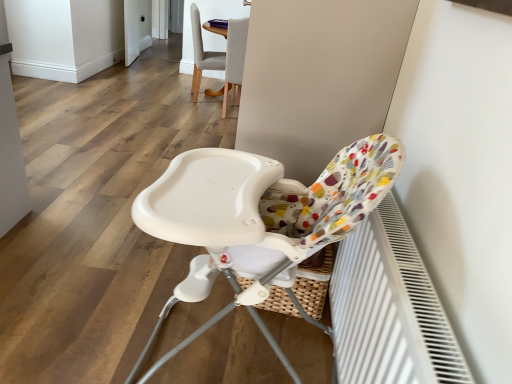
Question: Is white glossy screen door at upper left positioned with its back to white plastic highchair at center, the first chair when ordered from bottom to top?

Choices:
 (A) yes
 (B) no

Answer: (B)

Question: From a real-world perspective, is white glossy screen door at upper left located beneath white plastic highchair at center, positioned as the third chair in back-to-front order?

Choices:
 (A) yes
 (B) no

Answer: (A)

Question: Is white glossy screen door at upper left positioned before white plastic highchair at center, which is the first chair from front to back?

Choices:
 (A) no
 (B) yes

Answer: (A)

Question: Does white glossy screen door at upper left have a greater width compared to white plastic highchair at center, the first chair when ordered from bottom to top?

Choices:
 (A) no
 (B) yes

Answer: (A)

Question: Is white glossy screen door at upper left bigger than white plastic highchair at center, the first chair when ordered from bottom to top?

Choices:
 (A) yes
 (B) no

Answer: (B)

Question: In the image, is white textured radiator at lower right positioned in front of or behind light gray fabric chair at upper center, arranged as the 3th chair when viewed from the front?

Choices:
 (A) behind
 (B) front

Answer: (B)

Question: Is white textured radiator at lower right taller or shorter than light gray fabric chair at upper center, the 1th chair viewed from the back?

Choices:
 (A) tall
 (B) short

Answer: (B)

Question: Does point 408,340 appear closer or farther from the camera than point 197,24?

Choices:
 (A) farther
 (B) closer

Answer: (B)

Question: Looking at the image, does white textured radiator at lower right seem bigger or smaller compared to light gray fabric chair at upper center, the 3th chair when ordered from bottom to top?

Choices:
 (A) big
 (B) small

Answer: (B)

Question: From a real-world perspective, is light gray fabric chair at upper center, arranged as the 3th chair when viewed from the front, above or below white glossy screen door at upper left?

Choices:
 (A) above
 (B) below

Answer: (A)

Question: In terms of width, does light gray fabric chair at upper center, arranged as the 3th chair when viewed from the front, look wider or thinner when compared to white glossy screen door at upper left?

Choices:
 (A) thin
 (B) wide

Answer: (B)

Question: Is point (199, 34) positioned closer to the camera than point (150, 39)?

Choices:
 (A) closer
 (B) farther

Answer: (A)

Question: Would you say light gray fabric chair at upper center, the 3th chair when ordered from bottom to top, is to the left or to the right of white glossy screen door at upper left in the picture?

Choices:
 (A) right
 (B) left

Answer: (A)

Question: From a real-world perspective, is white textured radiator at lower right above or below matte gray chair at upper center, the 2th chair in the front-to-back sequence?

Choices:
 (A) above
 (B) below

Answer: (B)

Question: Would you say white textured radiator at lower right is inside or outside matte gray chair at upper center, the 2th chair from the back?

Choices:
 (A) outside
 (B) inside

Answer: (A)